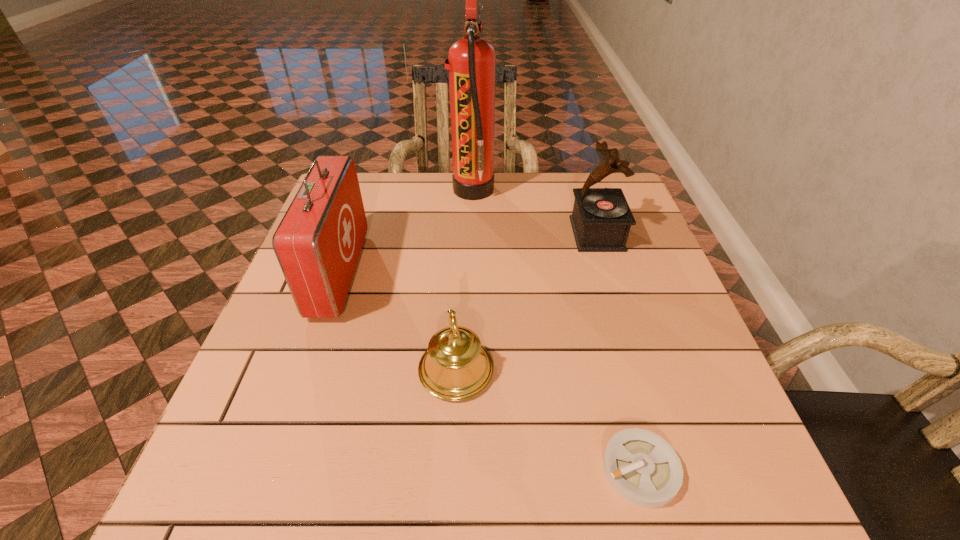
At what (x,y) coordinates should I click in order to perform the action: click on vacant space located at the horn opening of the phonograph_record. Please return your answer as a coordinate pair (x, y). Looking at the image, I should click on (428, 234).

I want to click on free region located at the horn opening of the phonograph_record, so (x=546, y=234).

Identify the location of vacant space located 0.320m at the horn opening of the phonograph_record. The height and width of the screenshot is (540, 960). (451, 234).

The height and width of the screenshot is (540, 960). I want to click on free point located 0.170m on the front of the fourth farthest object, so click(450, 503).

Where is `vacant position located 0.400m on the left of the nearest object`? The height and width of the screenshot is (540, 960). vacant position located 0.400m on the left of the nearest object is located at coordinates (354, 469).

Where is `fire extinguisher that is at the far edge`? Image resolution: width=960 pixels, height=540 pixels. fire extinguisher that is at the far edge is located at coordinates (471, 62).

The image size is (960, 540). I want to click on phonograph_record that is at the far edge, so click(x=601, y=219).

This screenshot has height=540, width=960. In order to click on object located at the near edge in this screenshot , I will do `click(644, 469)`.

Locate an element on the screen. The image size is (960, 540). object situated at the left edge is located at coordinates (318, 242).

Identify the location of phonograph_record at the right edge. The image size is (960, 540). (601, 219).